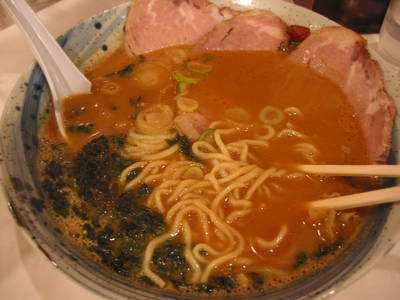
Identify the location of white surface. pos(32,280).